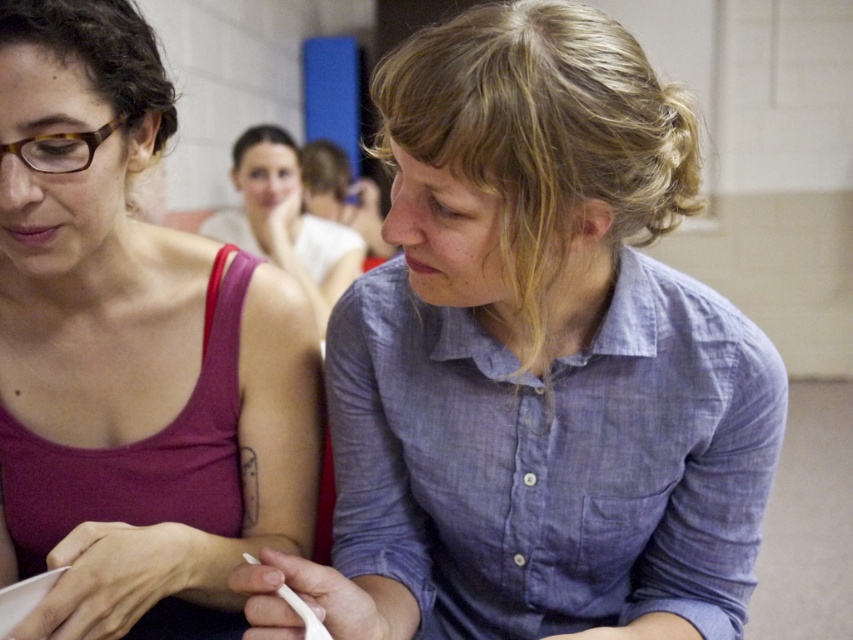
Does point (73, 218) come in front of point (320, 252)?

That is True.

Who is positioned more to the left, matte red tank top at left or matte blue shirt at center?

matte blue shirt at center

Does point (45, 67) come in front of point (283, 259)?

That is True.

I want to click on matte red tank top at left, so 131,333.

Who is lower down, blue cotton shirt at center or matte red tank top at left?

blue cotton shirt at center is lower down.

Is blue cotton shirt at center wider than matte red tank top at left?

Yes, blue cotton shirt at center is wider than matte red tank top at left.

Between point (608, 32) and point (194, 579), which one is positioned in front?

Point (608, 32) is in front.

I want to click on blue cotton shirt at center, so click(x=535, y=362).

Who is lower down, blue cotton shirt at center or matte blue shirt at center?

blue cotton shirt at center

Between point (535, 476) and point (258, 173), which one is positioned behind?

The point (258, 173) is behind.

Is point (421, 248) in front of point (231, 234)?

Yes.

Locate an element on the screen. The height and width of the screenshot is (640, 853). blue cotton shirt at center is located at coordinates (535, 362).